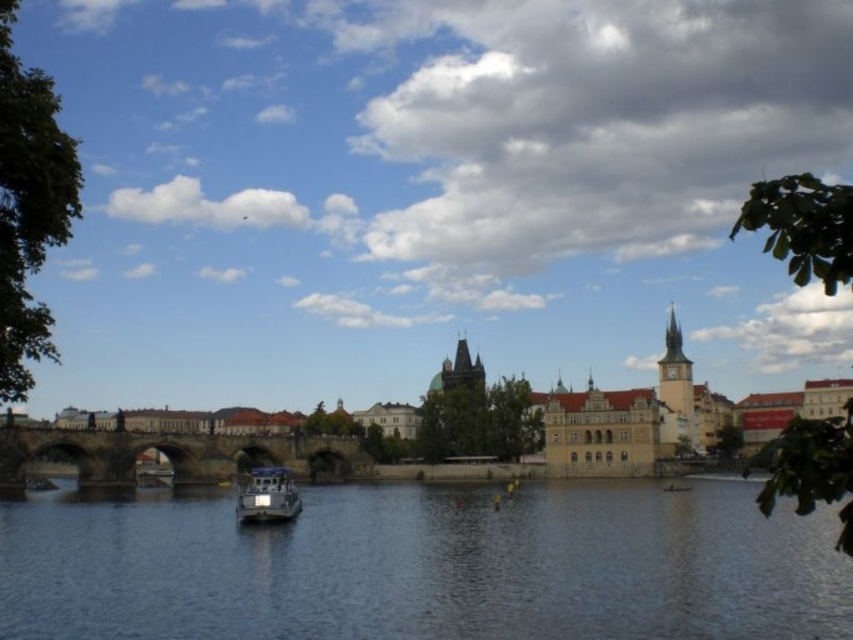
You are standing on the riverside and want to cross to the other side. The brown stone bridge at center and the metallic gray boat at center are both options. Which one is closer to you?

The brown stone bridge at center is positioned over the metallic gray boat at center, meaning the bridge is closer to you since it is above the boat in the scene.

You are an architect designing a new riverside walkway. You need to place a bench so that it faces the dark blue water at center. According to the coordinates provided, where should you position the bench to ensure it faces the water directly?

The dark blue water at center is located at coordinates point (426, 566), so positioning the bench facing towards these coordinates would ensure it faces the water directly.